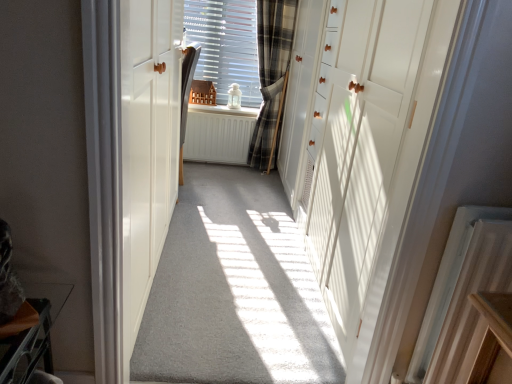
Question: Can you confirm if white plastic radiator at lower right, arranged as the second radiator when viewed from the top, is taller than white matte radiator at center, marked as the 2th radiator in a right-to-left arrangement?

Choices:
 (A) yes
 (B) no

Answer: (A)

Question: Is white plastic radiator at lower right, the 2th radiator in the left-to-right sequence, directly adjacent to white matte radiator at center, acting as the second radiator starting from the bottom?

Choices:
 (A) no
 (B) yes

Answer: (A)

Question: From the image's perspective, is white plastic radiator at lower right, the 2th radiator from the back, below white matte radiator at center, acting as the second radiator starting from the bottom?

Choices:
 (A) no
 (B) yes

Answer: (B)

Question: Is white plastic radiator at lower right, acting as the 1th radiator starting from the front, to the right of white matte radiator at center, which is the 1th radiator from back to front, from the viewer's perspective?

Choices:
 (A) no
 (B) yes

Answer: (B)

Question: From the image's perspective, would you say white plastic radiator at lower right, the 1th radiator in the bottom-to-top sequence, is positioned over white matte radiator at center, which is the 1th radiator from back to front?

Choices:
 (A) no
 (B) yes

Answer: (A)

Question: Is white plastic radiator at lower right, the 1th radiator in the bottom-to-top sequence, closer to the viewer compared to white matte radiator at center, acting as the second radiator starting from the bottom?

Choices:
 (A) no
 (B) yes

Answer: (B)

Question: Can you confirm if white glossy cabinet at right, the first door from the right, is taller than plaid fabric at center?

Choices:
 (A) no
 (B) yes

Answer: (B)

Question: From the image's perspective, is white glossy cabinet at right, which is counted as the second door, starting from the left, located above plaid fabric at center?

Choices:
 (A) no
 (B) yes

Answer: (A)

Question: Considering the relative positions of white glossy cabinet at right, the first door from the right, and plaid fabric at center in the image provided, is white glossy cabinet at right, the first door from the right, in front of plaid fabric at center?

Choices:
 (A) no
 (B) yes

Answer: (B)

Question: Is white glossy cabinet at right, the first door from the right, behind plaid fabric at center?

Choices:
 (A) no
 (B) yes

Answer: (A)

Question: Considering the relative positions of white glossy cabinet at right, the first door from the right, and plaid fabric at center in the image provided, is white glossy cabinet at right, the first door from the right, to the left of plaid fabric at center from the viewer's perspective?

Choices:
 (A) no
 (B) yes

Answer: (A)

Question: Is white glossy cabinet at right, which is counted as the second door, starting from the left, aimed at plaid fabric at center?

Choices:
 (A) no
 (B) yes

Answer: (B)

Question: Would you say white painted wood at center is part of white wood door at left, the first door from the left,'s contents?

Choices:
 (A) yes
 (B) no

Answer: (B)